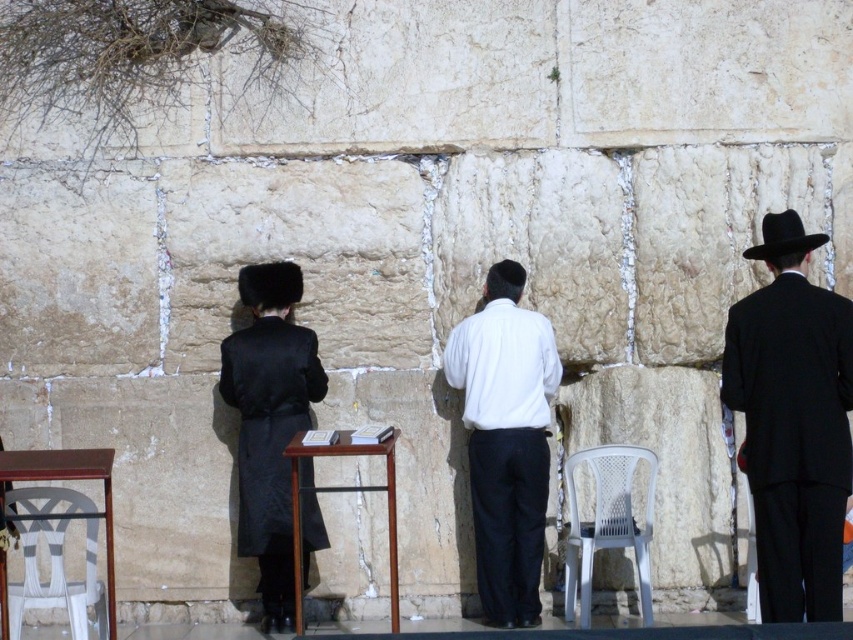
Question: Which object is farther from the camera taking this photo?

Choices:
 (A) white matte shirt at center
 (B) black wool coat at center
 (C) black fur hat at center
 (D) white plastic chair at center

Answer: (C)

Question: Does white matte shirt at center come behind white plastic chair at lower left?

Choices:
 (A) yes
 (B) no

Answer: (A)

Question: Is white plastic chair at center below wooden table at center?

Choices:
 (A) no
 (B) yes

Answer: (A)

Question: Can you confirm if white plastic chair at lower left is positioned to the right of black fur hat at center?

Choices:
 (A) no
 (B) yes

Answer: (A)

Question: Which object appears farthest from the camera in this image?

Choices:
 (A) wooden table at center
 (B) white matte shirt at center

Answer: (B)

Question: Which object is farther from the camera taking this photo?

Choices:
 (A) black fur hat at center
 (B) black felt hat at right
 (C) white plastic chair at lower left
 (D) black wool coat at center

Answer: (A)